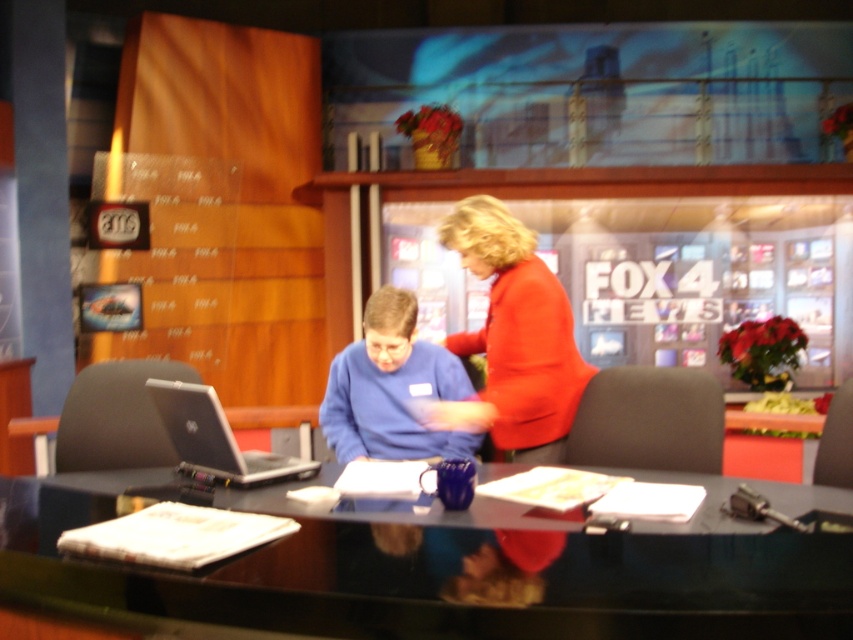
Does matte red sweater at center have a larger size compared to blue matte sweater at center?

Indeed, matte red sweater at center has a larger size compared to blue matte sweater at center.

How much distance is there between matte red sweater at center and blue matte sweater at center?

matte red sweater at center and blue matte sweater at center are 9.08 inches apart from each other.

Does point (503, 308) lie behind point (438, 355)?

No, it is not.

Locate an element on the screen. matte red sweater at center is located at coordinates (514, 337).

Is point (792, 592) positioned behind point (389, 317)?

No, (792, 592) is in front of (389, 317).

Consider the image. Is shiny black desk at center positioned before blue matte sweater at center?

Yes.

This screenshot has height=640, width=853. I want to click on shiny black desk at center, so click(430, 573).

Who is positioned more to the left, shiny black desk at center or silver metallic laptop at center?

From the viewer's perspective, silver metallic laptop at center appears more on the left side.

The height and width of the screenshot is (640, 853). Describe the element at coordinates (430, 573) in the screenshot. I see `shiny black desk at center` at that location.

Find the location of a particular element. shiny black desk at center is located at coordinates (430, 573).

This screenshot has width=853, height=640. I want to click on shiny black desk at center, so click(x=430, y=573).